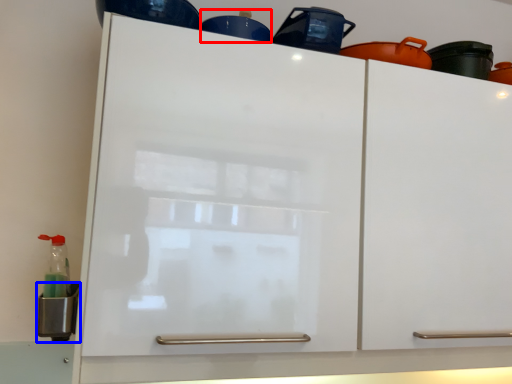
Question: Which of the following is the farthest to the observer, appliance (highlighted by a red box) or appliance (highlighted by a blue box)?

Choices:
 (A) appliance
 (B) appliance

Answer: (A)